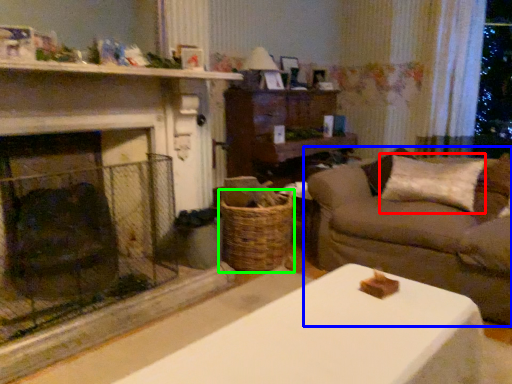
Question: Estimate the real-world distances between objects in this image. Which object is farther from pillow (highlighted by a red box), studio couch (highlighted by a blue box) or basket (highlighted by a green box)?

Choices:
 (A) studio couch
 (B) basket

Answer: (B)